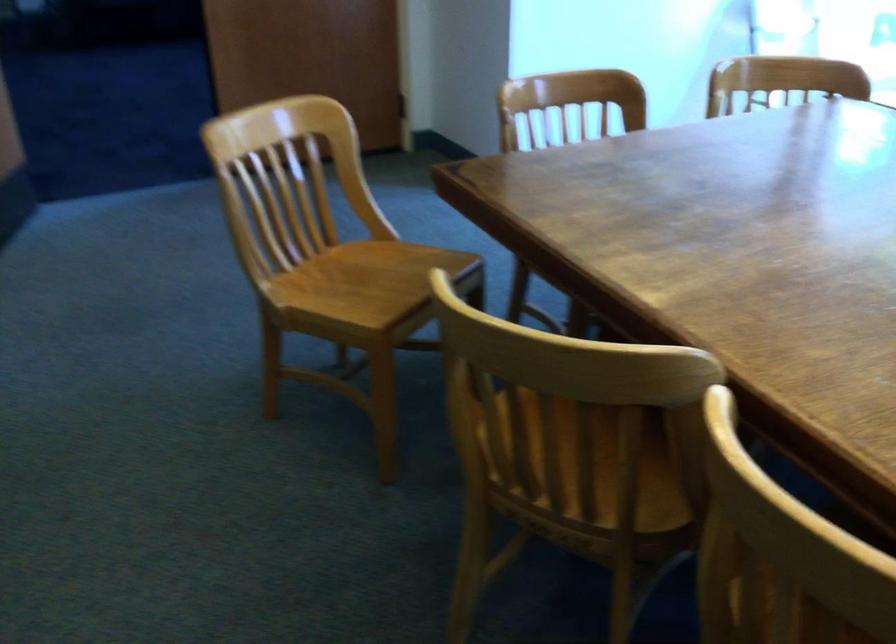
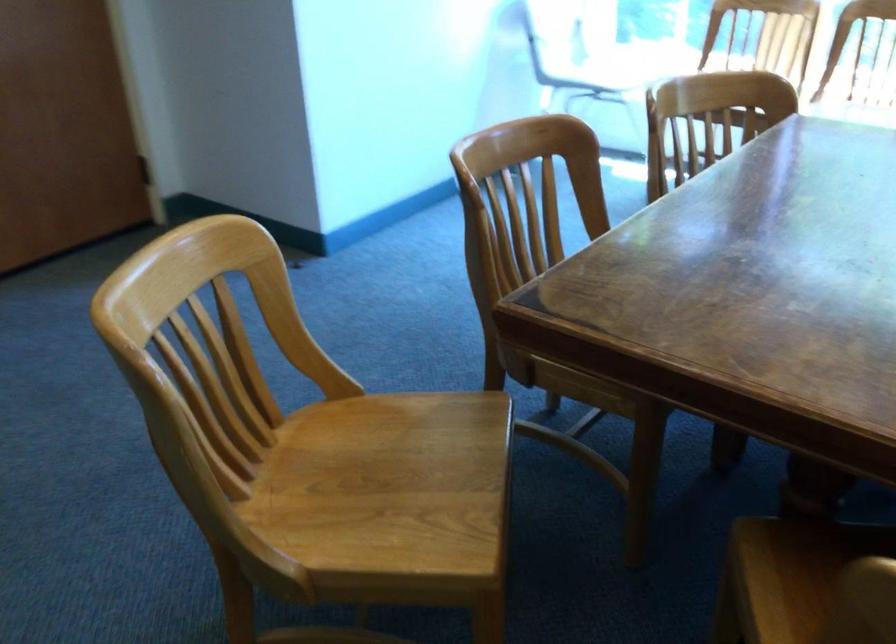
Find the pixel in the second image that matches (x=364, y=283) in the first image.

(383, 484)